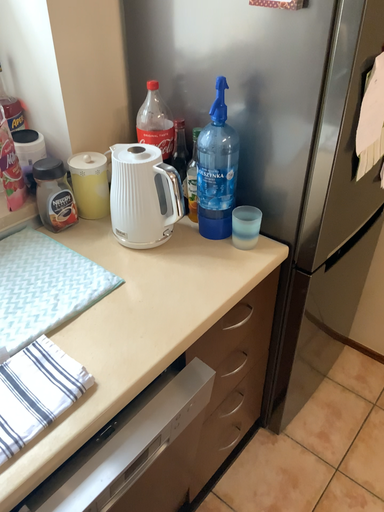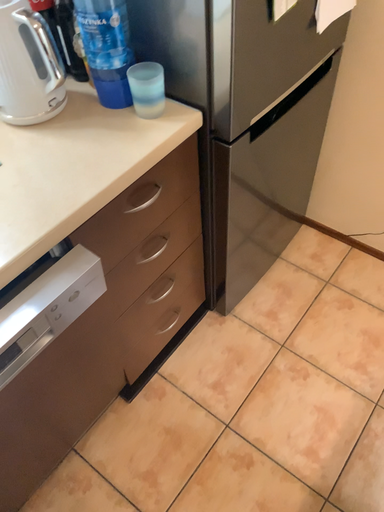
Question: Which way did the camera rotate in the video?

Choices:
 (A) rotated upward
 (B) rotated downward

Answer: (B)